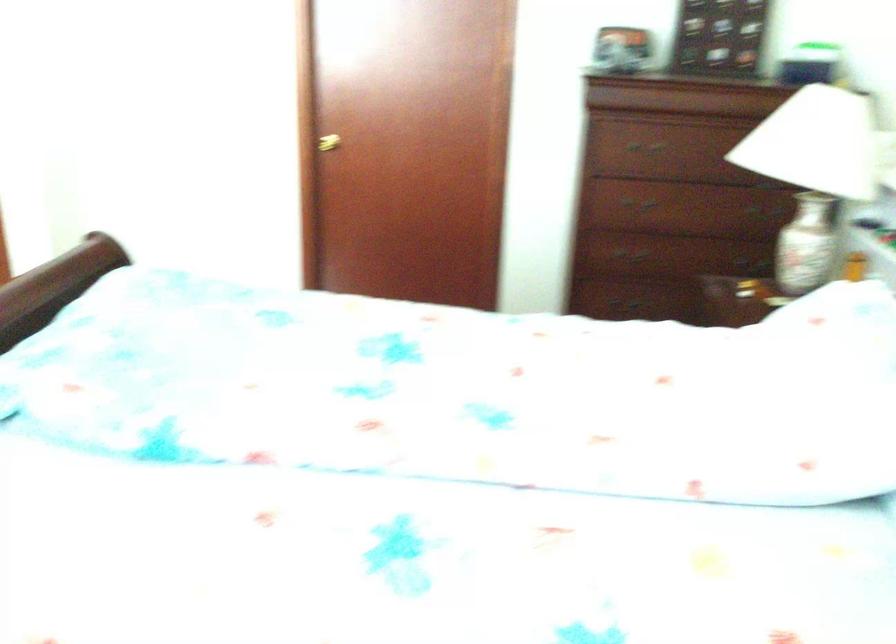
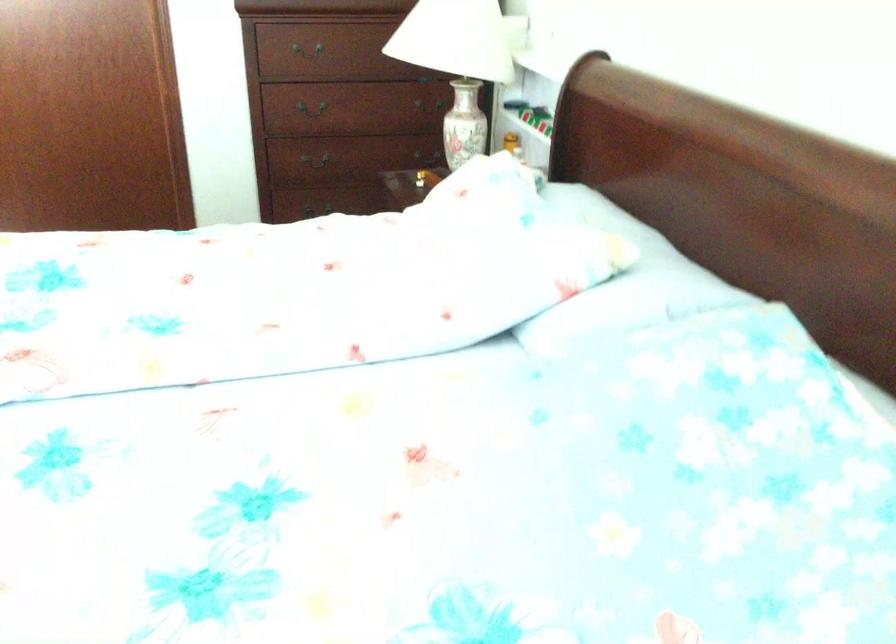
Locate, in the second image, the point that corresponds to (x=650, y=149) in the first image.

(309, 52)